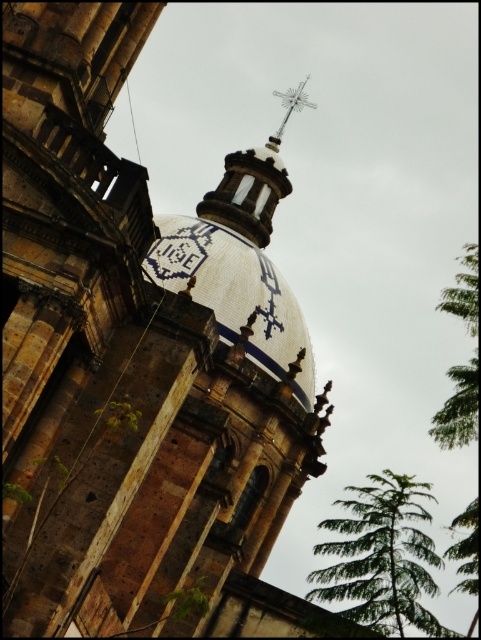
From the picture: You are standing in front of the historic building and notice a specific point marked at coordinates (235, 292). Based on the image, where is this point located?

The point at (235, 292) is located on the white ceramic dome at center.